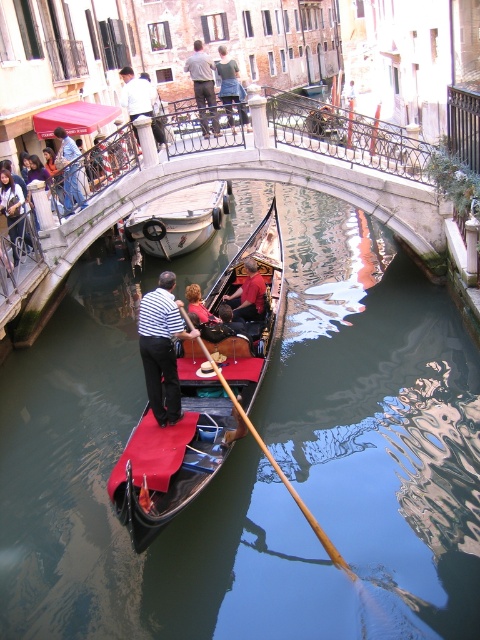
Is smooth dark water at center taller than white shirt at upper center?

In fact, smooth dark water at center may be shorter than white shirt at upper center.

What do you see at coordinates (109, 502) in the screenshot? I see `smooth dark water at center` at bounding box center [109, 502].

Who is more forward, (x=478, y=540) or (x=126, y=81)?

Positioned in front is point (x=478, y=540).

Image resolution: width=480 pixels, height=640 pixels. In order to click on smooth dark water at center in this screenshot , I will do point(109,502).

Is point (342, 444) farther from camera compared to point (200, 211)?

No, (342, 444) is in front of (200, 211).

Between smooth dark water at center and silver metallic boat at center, which one is positioned higher?

silver metallic boat at center is higher up.

This screenshot has height=640, width=480. Identify the location of smooth dark water at center. (109, 502).

Locate an element on the screen. This screenshot has height=640, width=480. smooth dark water at center is located at coordinates (109, 502).

Is point (175, 320) less distant than point (151, 113)?

Yes, point (175, 320) is closer to viewer.

Does striped fabric shirt at center have a greater width compared to white shirt at upper center?

Incorrect, striped fabric shirt at center's width does not surpass white shirt at upper center's.

What do you see at coordinates (162, 348) in the screenshot? This screenshot has width=480, height=640. I see `striped fabric shirt at center` at bounding box center [162, 348].

Image resolution: width=480 pixels, height=640 pixels. I want to click on striped fabric shirt at center, so click(x=162, y=348).